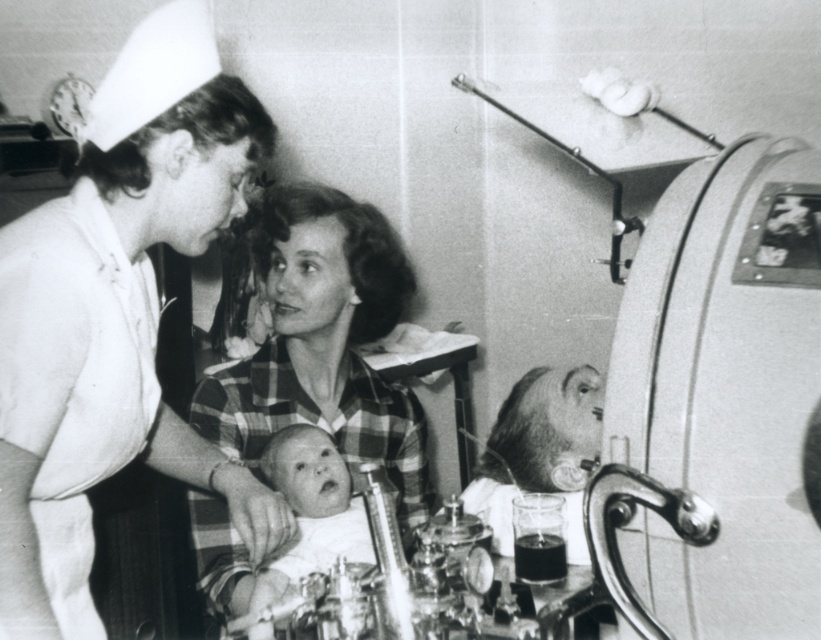
Question: Which of the following is the farthest from the observer?

Choices:
 (A) (331, 452)
 (B) (260, 244)
 (C) (214, 152)

Answer: (B)

Question: From the image, what is the correct spatial relationship of plaid fabric shirt at center in relation to smooth white baby at center?

Choices:
 (A) right
 (B) left

Answer: (A)

Question: Does white uniform at center appear over plaid fabric shirt at center?

Choices:
 (A) no
 (B) yes

Answer: (B)

Question: Is white uniform at center smaller than plaid fabric shirt at center?

Choices:
 (A) no
 (B) yes

Answer: (B)

Question: Which point is closer to the camera?

Choices:
 (A) (292, 561)
 (B) (28, 426)
 (C) (386, 323)

Answer: (B)

Question: Among these points, which one is farthest from the camera?

Choices:
 (A) (209, 433)
 (B) (12, 465)

Answer: (A)